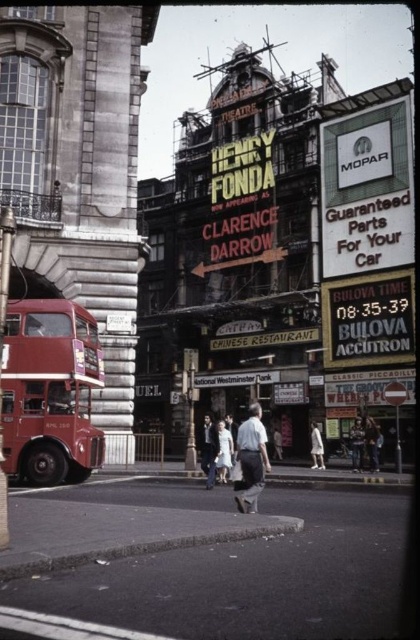
Question: Which point is farther to the camera?

Choices:
 (A) white cotton dress at center
 (B) dark blue jeans at center

Answer: (A)

Question: Among these objects, which one is farthest from the camera?

Choices:
 (A) white cotton dress at center
 (B) dark blue jeans at center

Answer: (A)

Question: Is light blue denim jacket at center positioned at the back of dark blue jeans at center?

Choices:
 (A) yes
 (B) no

Answer: (B)

Question: Does maroon metallic bus at left appear under light blue shirt at center?

Choices:
 (A) yes
 (B) no

Answer: (B)

Question: Does light blue jeans at center come behind dark blue jeans at center?

Choices:
 (A) no
 (B) yes

Answer: (A)

Question: Among these objects, which one is nearest to the camera?

Choices:
 (A) light blue denim jacket at center
 (B) light blue shirt at center
 (C) maroon metallic bus at left

Answer: (C)